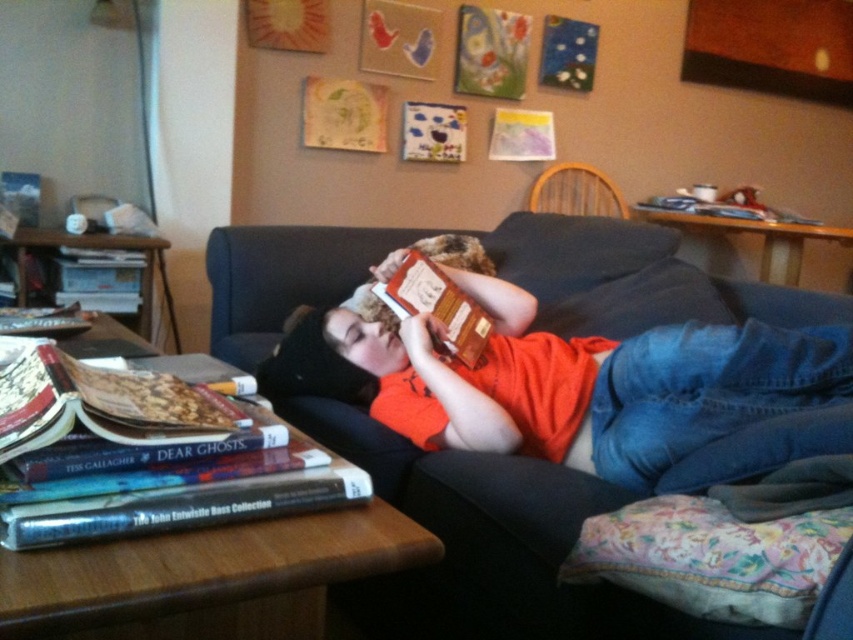
Does hardcover book at lower left lie in front of wooden chair at upper center?

Yes, hardcover book at lower left is closer to the viewer.

Can you confirm if hardcover book at lower left is shorter than wooden chair at upper center?

Yes.

What do you see at coordinates (149, 456) in the screenshot?
I see `hardcover book at lower left` at bounding box center [149, 456].

Locate an element on the screen. This screenshot has height=640, width=853. hardcover book at lower left is located at coordinates (149, 456).

Between orange fabric head at center and wooden chair at upper center, which one has more height?

With more height is wooden chair at upper center.

Is point (363, 320) positioned in front of point (627, 214)?

Yes, point (363, 320) is closer to viewer.

Between point (360, 356) and point (556, 192), which one is positioned in front?

Positioned in front is point (360, 356).

At what (x,y) coordinates should I click in order to perform the action: click on orange fabric head at center. Please return your answer as a coordinate pair (x, y). The image size is (853, 640). Looking at the image, I should click on (366, 340).

Measure the distance between hardcover book at lower left and orange fabric head at center.

A distance of 29.34 inches exists between hardcover book at lower left and orange fabric head at center.

Who is higher up, hardcover book at lower left or orange fabric head at center?

orange fabric head at center is higher up.

Find the location of a particular element. Image resolution: width=853 pixels, height=640 pixels. hardcover book at lower left is located at coordinates (149, 456).